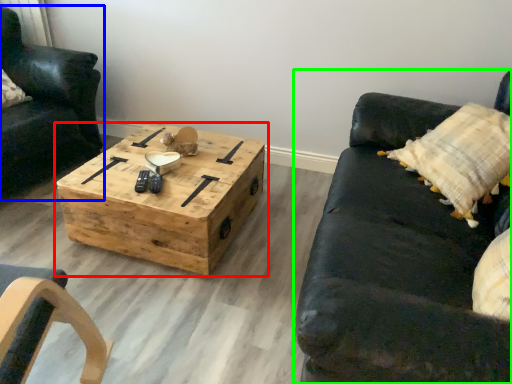
Question: Which object is the farthest from coffee table (highlighted by a red box)? Choose among these: chair (highlighted by a blue box) or studio couch (highlighted by a green box).

Choices:
 (A) chair
 (B) studio couch

Answer: (A)